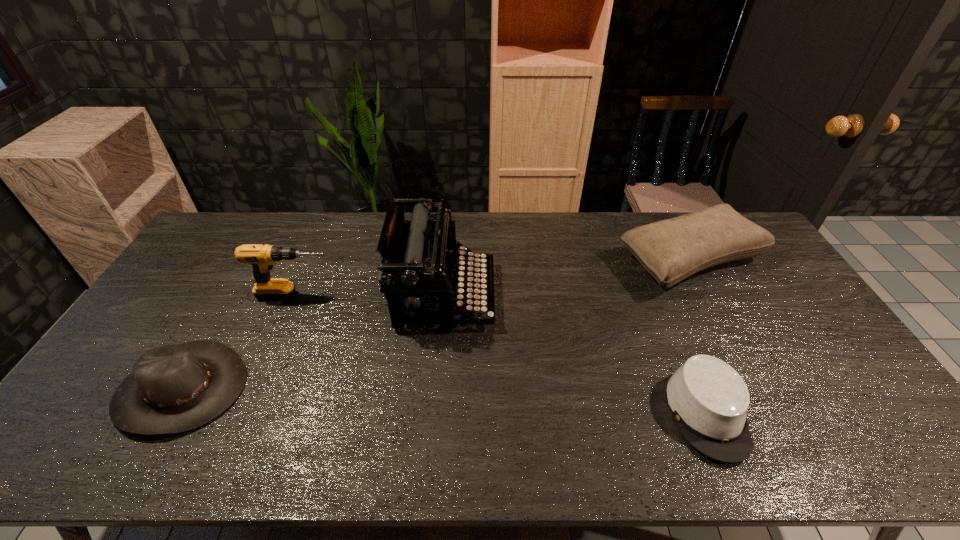
Find the location of a particular element. free space at the right edge of the desktop is located at coordinates (820, 327).

Find the location of `unoccupied area between the third object from left to right and the left hat`. unoccupied area between the third object from left to right and the left hat is located at coordinates (313, 342).

Locate an element on the screen. The height and width of the screenshot is (540, 960). empty space between the cushion and the third object from left to right is located at coordinates (567, 278).

The image size is (960, 540). I want to click on vacant region between the fourth shortest object and the shortest object, so click(x=502, y=355).

In order to click on free area in between the second shortest object and the third object from right to left in this screenshot , I will do coord(313,342).

Locate an element on the screen. The width and height of the screenshot is (960, 540). vacant space that is in between the taller hat and the drill is located at coordinates (239, 342).

Where is `vacant space that is in between the shorter hat and the third object from right to left`? vacant space that is in between the shorter hat and the third object from right to left is located at coordinates (576, 355).

The width and height of the screenshot is (960, 540). What are the coordinates of `empty location between the shorter hat and the cushion` in the screenshot? It's located at (699, 337).

You are a GUI agent. You are given a task and a screenshot of the screen. Output one action in this format:
    pyautogui.click(x=<x>, y=<y>)
    Task: Click on the free spot between the cushion and the right hat
    This screenshot has height=540, width=960.
    Given the screenshot: What is the action you would take?
    pyautogui.click(x=699, y=337)

Find the location of a particular element. empty location between the fourth tallest object and the fourth shortest object is located at coordinates (239, 342).